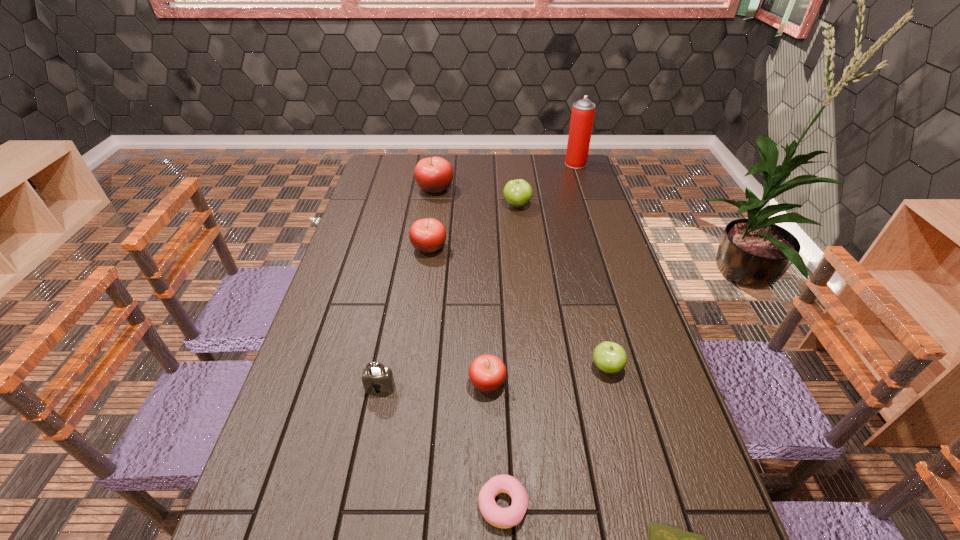
Locate an element on the screen. The height and width of the screenshot is (540, 960). the right green apple is located at coordinates (609, 357).

Image resolution: width=960 pixels, height=540 pixels. In order to click on the nearest red apple in this screenshot , I will do `click(487, 373)`.

Image resolution: width=960 pixels, height=540 pixels. I want to click on the rightmost red apple, so click(487, 373).

Locate an element on the screen. This screenshot has height=540, width=960. pink doughnut is located at coordinates (497, 516).

Identify the location of doughnut. coord(497,516).

Find the location of a particular element. free spot located 0.110m on the front of the red aerosol can is located at coordinates (582, 182).

Locate an element on the screen. vacant region located 0.390m on the right of the biggest red apple is located at coordinates click(553, 189).

Locate an element on the screen. vacant space located 0.340m on the left of the bigger green apple is located at coordinates (412, 205).

Image resolution: width=960 pixels, height=540 pixels. What are the coordinates of `blank space located on the front of the third nearest apple` in the screenshot? It's located at (416, 347).

Locate an element on the screen. vacant space located at the front of the padlock near the keyhole is located at coordinates (372, 430).